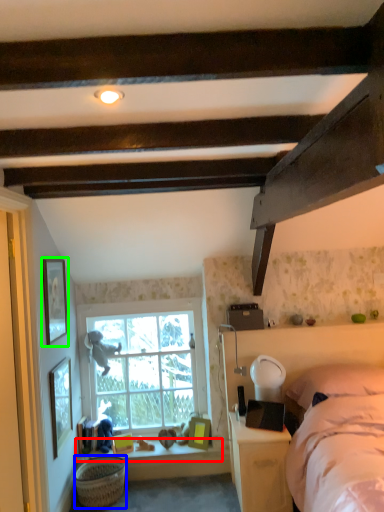
Question: Estimate the real-world distances between objects in this image. Which object is closer to window sill (highlighted by a red box), basket (highlighted by a blue box) or picture frame (highlighted by a green box)?

Choices:
 (A) basket
 (B) picture frame

Answer: (A)